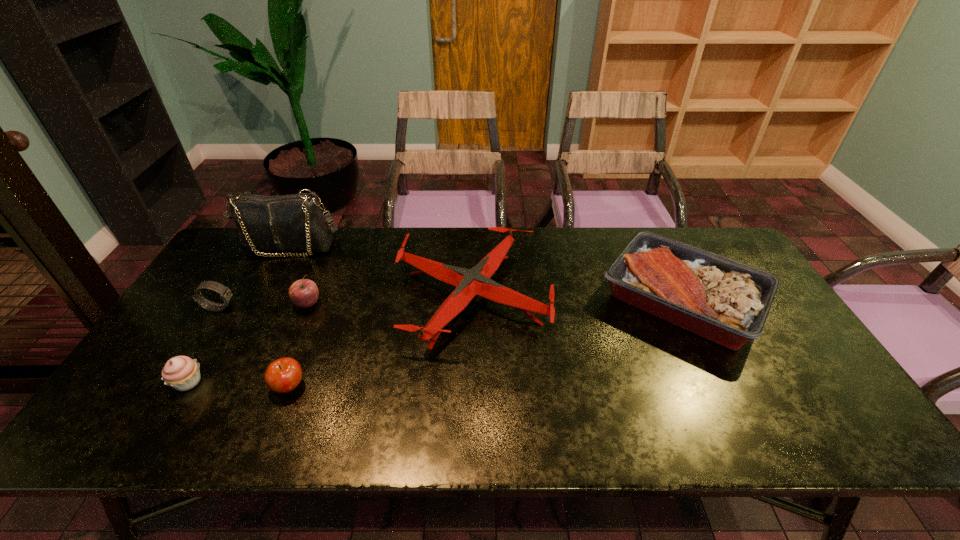
The width and height of the screenshot is (960, 540). In order to click on vacant space located 0.240m on the right of the farther apple in this screenshot , I will do `click(404, 304)`.

Identify the location of free space located 0.230m on the face of the watch. (315, 308).

At what (x,y) coordinates should I click in order to perform the action: click on vacant space located 0.100m on the front of the cupcake. Please return your answer as a coordinate pair (x, y). The image size is (960, 540). Looking at the image, I should click on coord(156,436).

Find the location of a particular element. Image resolution: width=960 pixels, height=540 pixels. vacant area located 0.280m on the right of the nearer apple is located at coordinates (421, 387).

The image size is (960, 540). Find the location of `handbag located at the far edge`. handbag located at the far edge is located at coordinates (294, 222).

This screenshot has width=960, height=540. What are the coordinates of `tray present at the far edge` in the screenshot? It's located at 723,300.

You are a GUI agent. You are given a task and a screenshot of the screen. Output one action in this format:
    pyautogui.click(x=<x>, y=<y>)
    Task: Click on the drone positioned at the far edge
    
    Given the screenshot: What is the action you would take?
    pyautogui.click(x=476, y=281)

Identify the location of handbag at the left edge. The height and width of the screenshot is (540, 960). (294, 222).

Where is `watch that is at the left edge`? The image size is (960, 540). watch that is at the left edge is located at coordinates (225, 293).

Where is `cupcake that is at the left edge`? This screenshot has height=540, width=960. cupcake that is at the left edge is located at coordinates (181, 372).